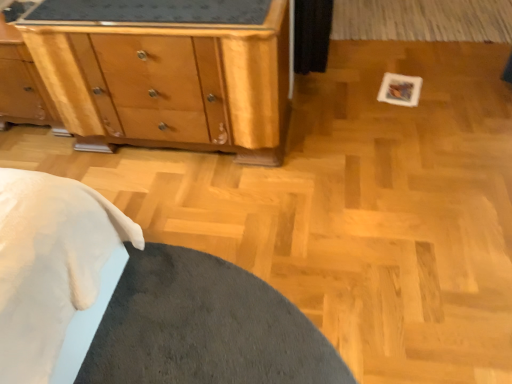
I want to click on light wood/finish chest of drawers at left, so click(x=167, y=73).

What is the approximate width of light wood/finish chest of drawers at left?

20.21 inches.

Image resolution: width=512 pixels, height=384 pixels. Describe the element at coordinates (167, 73) in the screenshot. I see `light wood/finish chest of drawers at left` at that location.

Where is `light wood/finish chest of drawers at left`? The width and height of the screenshot is (512, 384). light wood/finish chest of drawers at left is located at coordinates (167, 73).